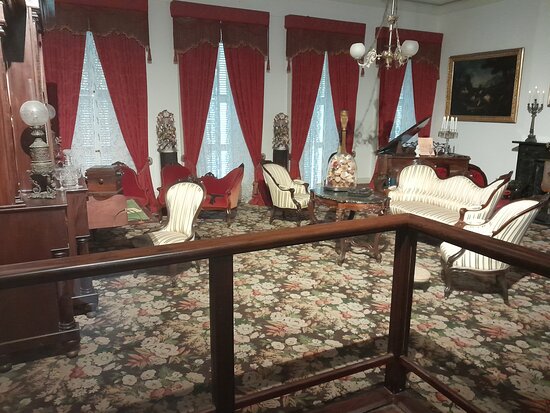
You are a GUI agent. You are given a task and a screenshot of the screen. Output one action in this format:
    pyautogui.click(x=<x>, y=<y>)
    Task: Click on the carpet
    
    Given the screenshot: What is the action you would take?
    pyautogui.click(x=132, y=303), pyautogui.click(x=296, y=293), pyautogui.click(x=450, y=314)